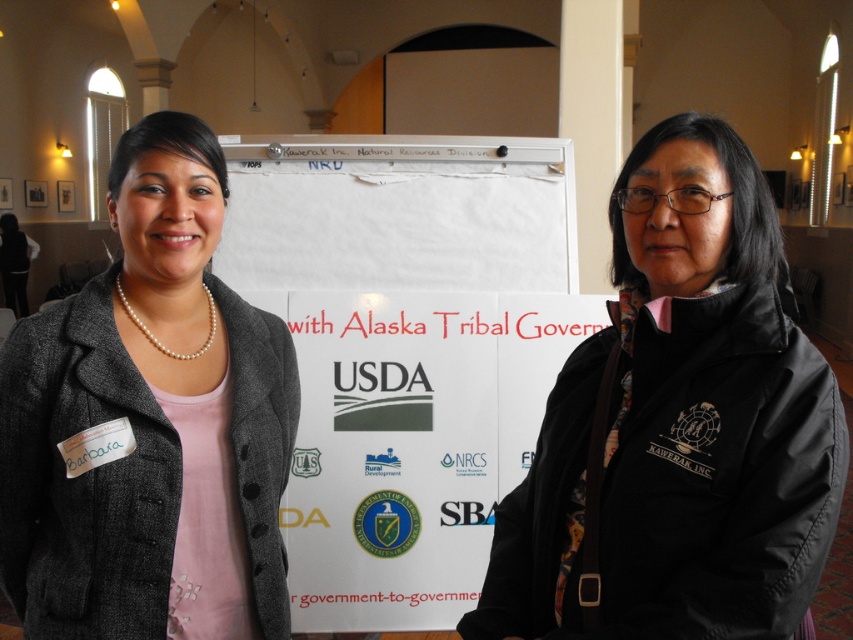
Does black matte jacket at center have a lesser height compared to pearl necklace at upper left?

Yes, black matte jacket at center is shorter than pearl necklace at upper left.

I want to click on black matte jacket at center, so click(677, 428).

Locate an element on the screen. This screenshot has height=640, width=853. black matte jacket at center is located at coordinates (677, 428).